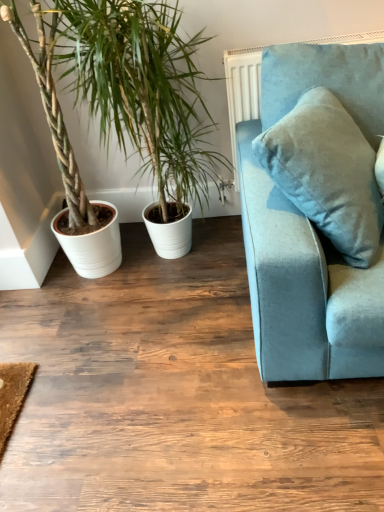
Where is `velvet blue couch at right`? velvet blue couch at right is located at coordinates (299, 271).

What do you see at coordinates (299, 271) in the screenshot? I see `velvet blue couch at right` at bounding box center [299, 271].

What is the approximate height of white ceramic plant at left?

The height of white ceramic plant at left is 3.66 feet.

The height and width of the screenshot is (512, 384). Identify the location of white ceramic plant at left. (143, 89).

Measure the distance between point (60, 34) and camera.

Point (60, 34) is 5.16 feet from camera.

This screenshot has width=384, height=512. What do you see at coordinates (143, 89) in the screenshot?
I see `white ceramic plant at left` at bounding box center [143, 89].

Locate an element on the screen. The width and height of the screenshot is (384, 512). velvet blue couch at right is located at coordinates (299, 271).

Which object is positioned more to the left, velvet blue couch at right or white ceramic plant at left?

From the viewer's perspective, white ceramic plant at left appears more on the left side.

Which is behind, velvet blue couch at right or white ceramic plant at left?

white ceramic plant at left.

Which is closer, (x=258, y=263) or (x=112, y=42)?

Point (x=258, y=263) is closer to the camera than point (x=112, y=42).

From the image's perspective, between velvet blue couch at right and white ceramic plant at left, which one is located above?

white ceramic plant at left.

From a real-world perspective, between velvet blue couch at right and white ceramic plant at left, who is vertically lower?

From a 3D spatial view, white ceramic plant at left is below.

Looking at their sizes, would you say velvet blue couch at right is wider or thinner than white ceramic plant at left?

velvet blue couch at right is thinner than white ceramic plant at left.

Does velvet blue couch at right have a lesser height compared to white ceramic plant at left?

Yes, velvet blue couch at right is shorter than white ceramic plant at left.

Looking at the image, does velvet blue couch at right seem bigger or smaller compared to white ceramic plant at left?

In the image, velvet blue couch at right appears to be smaller than white ceramic plant at left.

Is velvet blue couch at right inside or outside of white ceramic plant at left?

velvet blue couch at right cannot be found inside white ceramic plant at left.

Is velvet blue couch at right touching white ceramic plant at left?

No, velvet blue couch at right is not next to white ceramic plant at left.

Is velvet blue couch at right positioned with its back to white ceramic plant at left?

Absolutely, velvet blue couch at right is directed away from white ceramic plant at left.

Can you tell me how much velvet blue couch at right and white ceramic plant at left differ in facing direction?

velvet blue couch at right and white ceramic plant at left are facing 71.6 degrees away from each other.

The width and height of the screenshot is (384, 512). Identify the location of houseplant located on the left of velvet blue couch at right. (143, 89).

Which object is positioned more to the left, white ceramic plant at left or velvet blue couch at right?

Positioned to the left is white ceramic plant at left.

Consider the image. Is white ceramic plant at left further to the viewer compared to velvet blue couch at right?

Yes, white ceramic plant at left is further from the viewer.

Does point (141, 168) lie behind point (260, 374)?

Yes.

Based on the photo, from the image's perspective, who appears lower, white ceramic plant at left or velvet blue couch at right?

velvet blue couch at right.

From a real-world perspective, is white ceramic plant at left physically located above or below velvet blue couch at right?

Clearly, from a real-world perspective, white ceramic plant at left is below velvet blue couch at right.

Which object is thinner, white ceramic plant at left or velvet blue couch at right?

velvet blue couch at right.

Considering the sizes of objects white ceramic plant at left and velvet blue couch at right in the image provided, who is taller, white ceramic plant at left or velvet blue couch at right?

white ceramic plant at left is taller.

Does white ceramic plant at left have a smaller size compared to velvet blue couch at right?

Incorrect, white ceramic plant at left is not smaller in size than velvet blue couch at right.

Can we say white ceramic plant at left lies outside velvet blue couch at right?

Yes, white ceramic plant at left is located beyond the bounds of velvet blue couch at right.

Would you consider white ceramic plant at left to be distant from velvet blue couch at right?

No, white ceramic plant at left is not far from velvet blue couch at right.

Could you tell me if white ceramic plant at left is facing velvet blue couch at right?

No.

How different are the orientations of white ceramic plant at left and velvet blue couch at right in degrees?

The angular difference between white ceramic plant at left and velvet blue couch at right is 71.6 degrees.

This screenshot has height=512, width=384. Find the location of `studio couch on the right of white ceramic plant at left`. studio couch on the right of white ceramic plant at left is located at coordinates (299, 271).

The height and width of the screenshot is (512, 384). Identify the location of studio couch located above the white ceramic plant at left (from a real-world perspective). (299, 271).

This screenshot has height=512, width=384. Identify the location of studio couch located on the right of white ceramic plant at left. (299, 271).